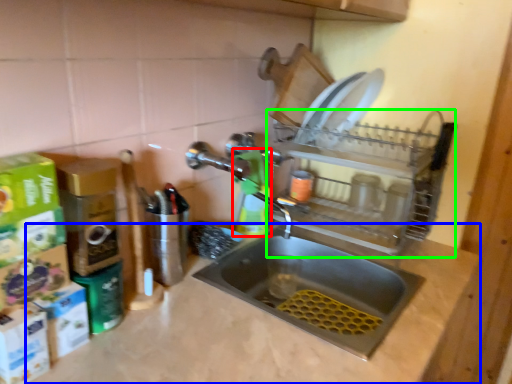
Question: Based on their relative distances, which object is nearer to cleaning product (highlighted by a red box)? Choose from counter top (highlighted by a blue box) and appliance (highlighted by a green box).

Choices:
 (A) counter top
 (B) appliance

Answer: (B)